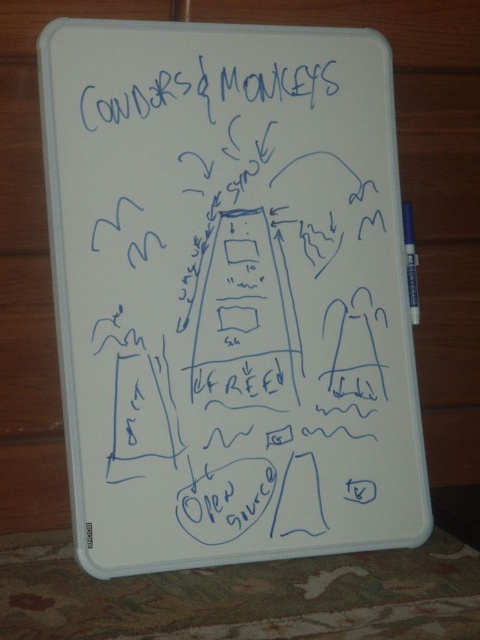
You are standing in a room where the whiteboard is placed on a wooden surface. You need to locate the white matte whiteboard at center. According to the coordinates given, where exactly is it positioned?

The white matte whiteboard at center is positioned at point (228, 292).

You are standing in a room where the whiteboard is placed on a wooden surface. You notice the white matte whiteboard at center and the blue ink writing at upper center. From the perspective of someone facing the whiteboard, which object is positioned to the left?

The blue ink writing at upper center is to the left of the white matte whiteboard at center.

You are an artist holding a white plastic pen at right and want to draw on the white matte whiteboard at center. Can you reach the whiteboard from your current position without moving your feet?

The white matte whiteboard at center is to the left of the white plastic pen at right. Since you are holding the pen at the right position, you can easily reach the whiteboard at center by extending your arm.